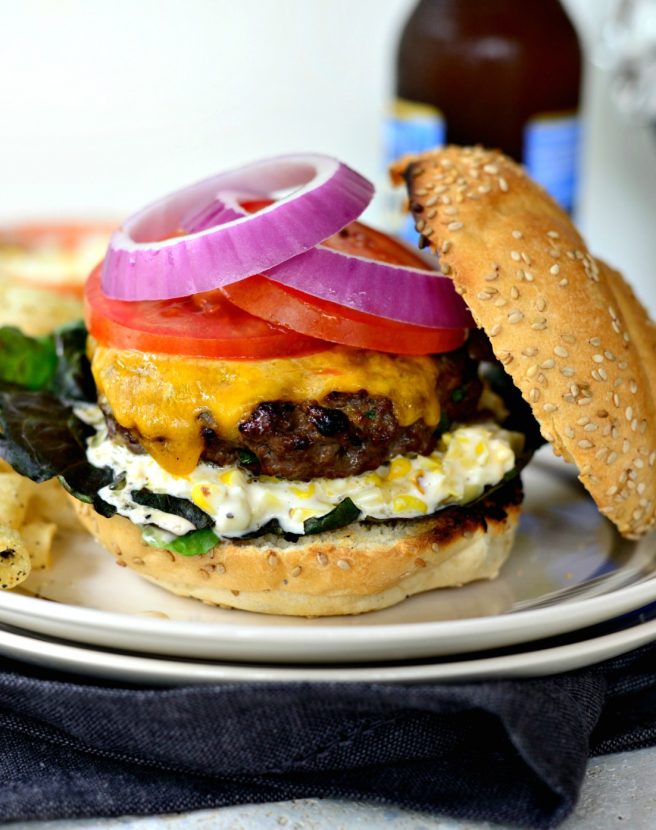
I want to click on bottle, so click(x=512, y=86).